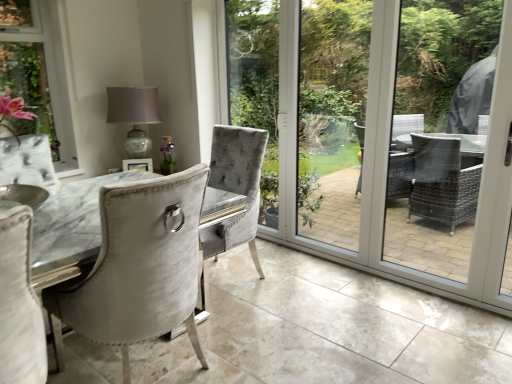
Question: Is satin white chair at center closer to the viewer compared to clear glass screen door at center, the second screen door viewed from the right?

Choices:
 (A) no
 (B) yes

Answer: (B)

Question: From a real-world perspective, does satin white chair at center sit lower than clear glass screen door at center, the 1th screen door viewed from the left?

Choices:
 (A) yes
 (B) no

Answer: (A)

Question: Does satin white chair at center have a smaller size compared to clear glass screen door at center, the 1th screen door viewed from the left?

Choices:
 (A) no
 (B) yes

Answer: (A)

Question: Does satin white chair at center turn towards clear glass screen door at center, the second screen door viewed from the right?

Choices:
 (A) yes
 (B) no

Answer: (B)

Question: Does satin white chair at center appear on the left side of clear glass screen door at center, the second screen door viewed from the right?

Choices:
 (A) yes
 (B) no

Answer: (A)

Question: Does satin white chair at center appear on the right side of clear glass screen door at center, the second screen door viewed from the right?

Choices:
 (A) no
 (B) yes

Answer: (A)

Question: Is clear glass screen door at center, the 1th screen door viewed from the left, aimed at white glossy screen door at right, which ranks as the 1th screen door in right-to-left order?

Choices:
 (A) no
 (B) yes

Answer: (A)

Question: From a real-world perspective, is clear glass screen door at center, the 1th screen door viewed from the left, located beneath white glossy screen door at right, which ranks as the 1th screen door in right-to-left order?

Choices:
 (A) no
 (B) yes

Answer: (A)

Question: Are clear glass screen door at center, the 1th screen door viewed from the left, and white glossy screen door at right, which ranks as the 1th screen door in right-to-left order, making contact?

Choices:
 (A) yes
 (B) no

Answer: (B)

Question: Can you confirm if clear glass screen door at center, the 1th screen door viewed from the left, is thinner than white glossy screen door at right, which ranks as the 1th screen door in right-to-left order?

Choices:
 (A) yes
 (B) no

Answer: (B)

Question: Can you confirm if clear glass screen door at center, the 1th screen door viewed from the left, is smaller than white glossy screen door at right, which ranks as the 1th screen door in right-to-left order?

Choices:
 (A) no
 (B) yes

Answer: (A)

Question: Is the depth of clear glass screen door at center, the second screen door viewed from the right, greater than that of white glossy screen door at right, which ranks as the 1th screen door in right-to-left order?

Choices:
 (A) no
 (B) yes

Answer: (A)

Question: Considering the relative sizes of matte glass table lamp at upper center and clear glass screen door at center, the 1th screen door viewed from the left, in the image provided, is matte glass table lamp at upper center smaller than clear glass screen door at center, the 1th screen door viewed from the left,?

Choices:
 (A) yes
 (B) no

Answer: (A)